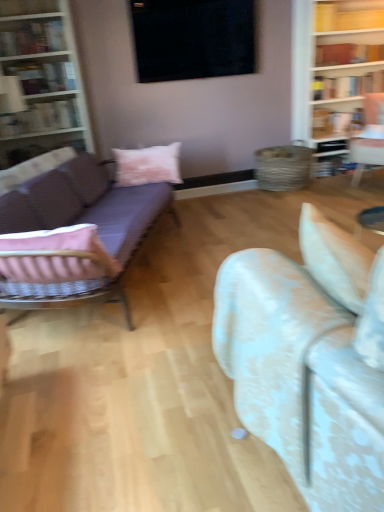
Question: Considering the positions of point coord(160,187) and point coord(354,109), is point coord(160,187) closer or farther from the camera than point coord(354,109)?

Choices:
 (A) farther
 (B) closer

Answer: (B)

Question: Considering the positions of purple fabric couch at left, acting as the second studio couch starting from the right, and hardcover book at upper right, positioned as the 4th book in front-to-back order, in the image, is purple fabric couch at left, acting as the second studio couch starting from the right, bigger or smaller than hardcover book at upper right, positioned as the 4th book in front-to-back order,?

Choices:
 (A) big
 (B) small

Answer: (A)

Question: Which is nearer to the hardcover book at upper right, positioned as the 4th book in front-to-back order?

Choices:
 (A) wooden bookshelf at left
 (B) hardcover book at upper right, positioned as the 3th book in front-to-back order
 (C) purple fabric couch at left, acting as the second studio couch starting from the right
 (D) black matte window at upper center
 (E) white floral fabric couch at center, the first studio couch when ordered from front to back

Answer: (B)

Question: Which object is positioned closest to the purple fabric couch at left, the first studio couch positioned from the left?

Choices:
 (A) black matte window at upper center
 (B) matte white bookshelf at left, placed as the fourth book when sorted from right to left
 (C) pink cotton pillow at center
 (D) matte black bookshelf at upper left, the second book from the left
 (E) hardcover book at upper right, the third book from the left

Answer: (C)